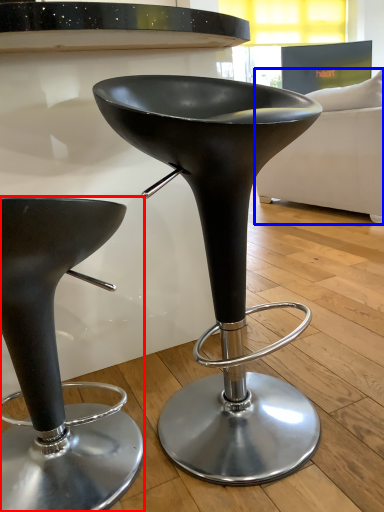
Question: Which point is further to the camera, stool (highlighted by a red box) or couch (highlighted by a blue box)?

Choices:
 (A) stool
 (B) couch

Answer: (B)